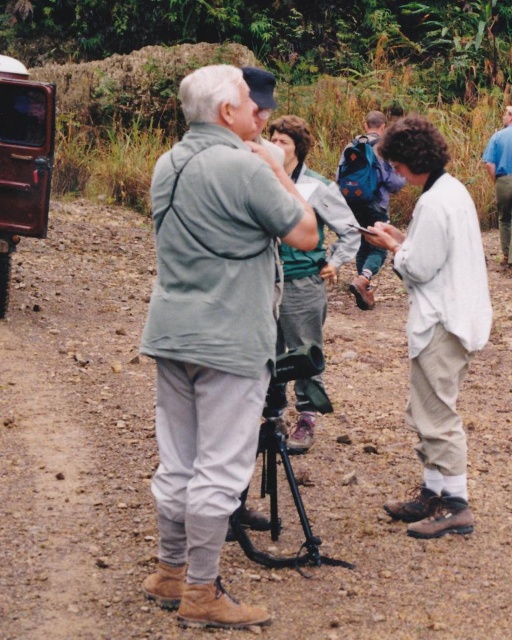
You are a photographer trying to position two markers in the scene. The markers are at point (231, 237) and point (293, 179). Which marker is closer to the camera?

Point (231, 237) is closer to the camera than point (293, 179).

You are standing at the point marked as point (493, 156) and want to take a photo of the person at point (430, 369). Since you are using a camera with a 90 degree field of view, will you be able to capture the person in your shot without moving?

Point (430, 369) is closer to the viewer than point (493, 156), so the distance between them is such that the person at point (430, 369) would be within the 90 degree field of view of the camera at point (493, 156). Therefore, yes, you can capture the person in your shot without moving.

You are navigating a drone over a rural area and need to land it precisely on the brown dirt track at center. Given that the drone has a GPS coordinate system where the bottom left corner is the origin point, can you confirm if the coordinates provided in the image description are suitable for a safe landing?

The brown dirt track at center is located at coordinates point (x=79, y=435), so yes, the drone can safely land there using those coordinates.